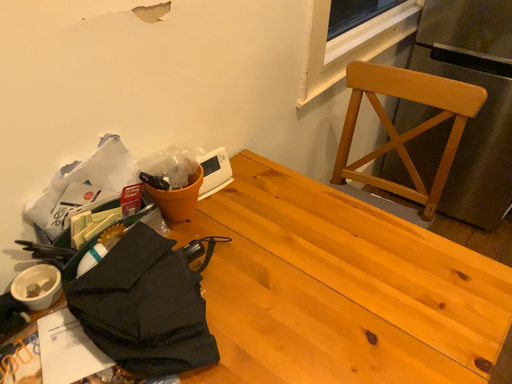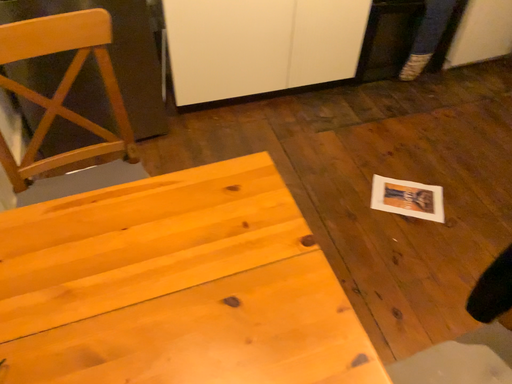
Question: How did the camera likely rotate when shooting the video?

Choices:
 (A) rotated right
 (B) rotated left

Answer: (A)